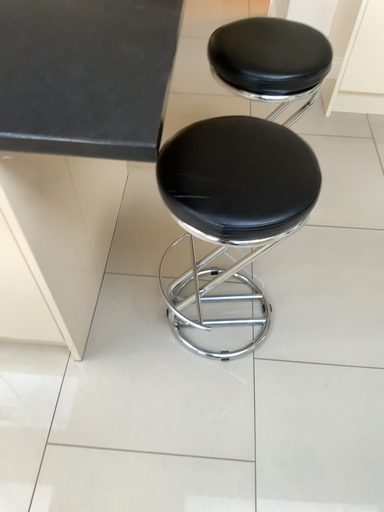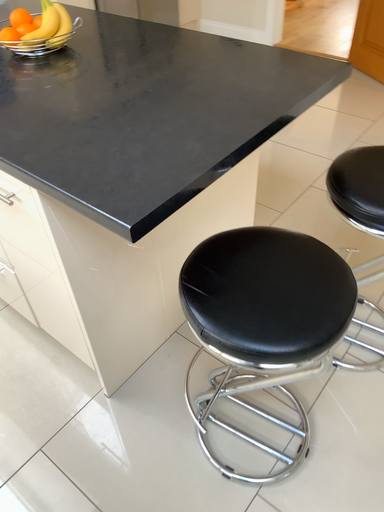
Question: How did the camera likely rotate when shooting the video?

Choices:
 (A) rotated upward
 (B) rotated downward

Answer: (A)